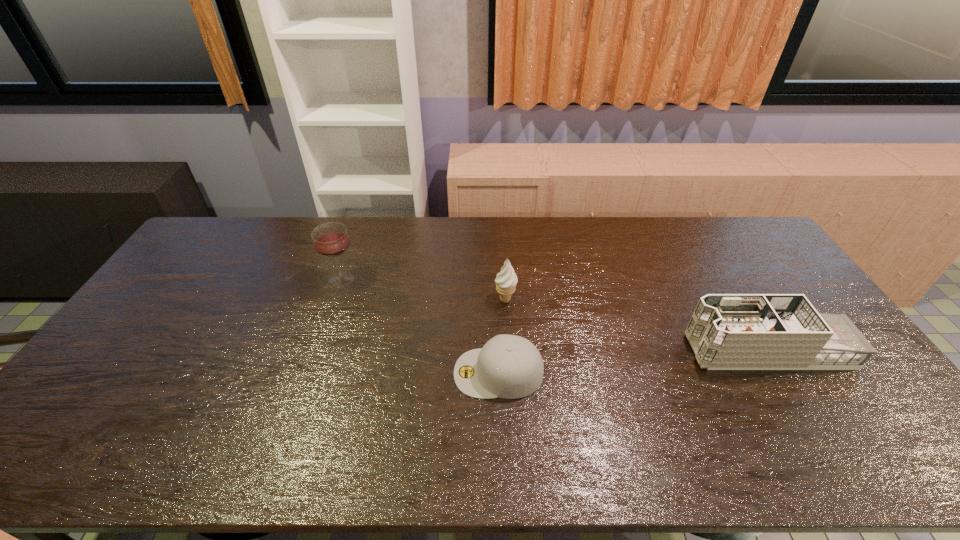
Find the location of a particular element. This screenshot has width=960, height=540. free space located 0.190m at the entrance of the rightmost object is located at coordinates (622, 350).

The width and height of the screenshot is (960, 540). Identify the location of free region located 0.360m at the entrance of the rightmost object. (562, 350).

The width and height of the screenshot is (960, 540). Identify the location of free space located 0.140m on the front-facing side of the shortest object. (401, 373).

The width and height of the screenshot is (960, 540). I want to click on free space located 0.400m on the front-facing side of the shortest object, so click(x=304, y=373).

This screenshot has width=960, height=540. I want to click on blank space located on the front-facing side of the shortest object, so click(397, 373).

The height and width of the screenshot is (540, 960). I want to click on object that is at the right edge, so click(x=727, y=331).

The image size is (960, 540). Find the location of `vacant space at the far edge of the desktop`. vacant space at the far edge of the desktop is located at coordinates (468, 230).

Image resolution: width=960 pixels, height=540 pixels. Find the location of `free space at the near edge`. free space at the near edge is located at coordinates (120, 456).

Locate an element on the screen. Image resolution: width=960 pixels, height=540 pixels. vacant area at the left edge of the desktop is located at coordinates (211, 279).

I want to click on free space at the right edge, so click(x=776, y=269).